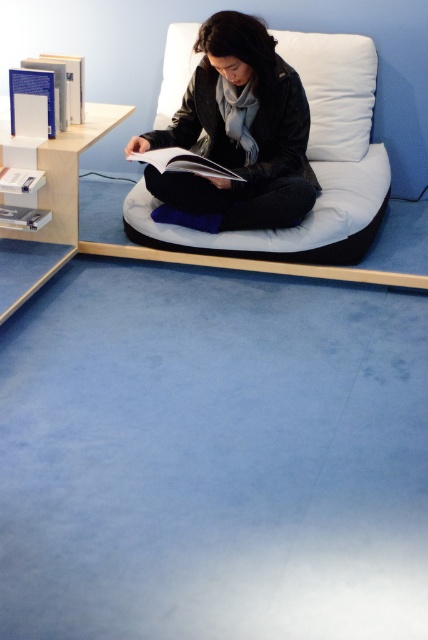
This screenshot has width=428, height=640. Describe the element at coordinates (64, 84) in the screenshot. I see `blue hardcover book at upper left` at that location.

Between blue hardcover book at upper left and white matte book at left, which one appears on the left side from the viewer's perspective?

white matte book at left

Is point (47, 61) closer to viewer compared to point (14, 180)?

No.

Locate an element on the screen. This screenshot has height=640, width=428. blue hardcover book at upper left is located at coordinates (64, 84).

Does white soft cushion at center appear over blue hardcover book at upper left?

Yes.

Is point (335, 120) positioned before point (80, 109)?

No, (335, 120) is behind (80, 109).

Locate an element on the screen. The height and width of the screenshot is (640, 428). white soft cushion at center is located at coordinates pos(333,90).

This screenshot has height=640, width=428. I want to click on white soft cushion at center, so click(x=333, y=90).

Is white paper book at center positioned at the back of white paper book at left?

No, white paper book at center is in front of white paper book at left.

Who is taller, white paper book at center or white paper book at left?

white paper book at center

Which is behind, point (202, 170) or point (26, 228)?

Positioned behind is point (26, 228).

Locate an element on the screen. white paper book at center is located at coordinates (183, 163).